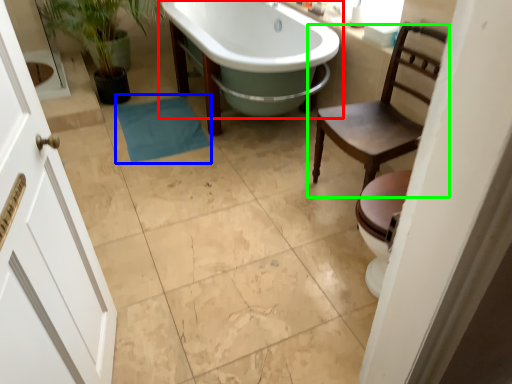
Question: Which is farther away from bathtub (highlighted by a red box)? bath towel (highlighted by a blue box) or chair (highlighted by a green box)?

Choices:
 (A) bath towel
 (B) chair

Answer: (B)